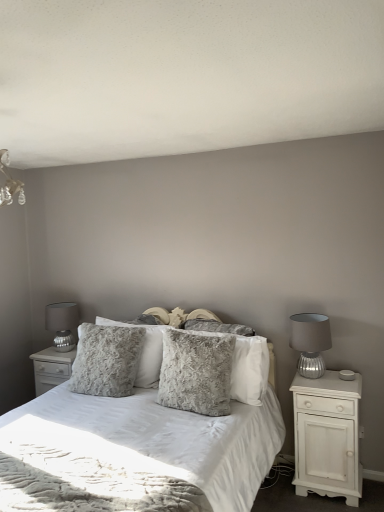
Find the location of `vacant region below matte silver lamp at right, which appears as the 1th table lamp when viewed from the right (from a real-world perspective)`. vacant region below matte silver lamp at right, which appears as the 1th table lamp when viewed from the right (from a real-world perspective) is located at coordinates (309, 377).